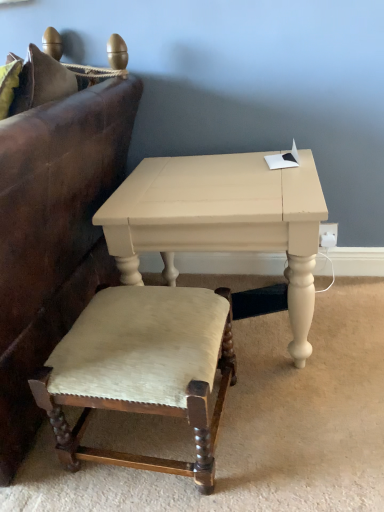
You are a GUI agent. You are given a task and a screenshot of the screen. Output one action in this format:
    pyautogui.click(x=<x>, y=<y>)
    Task: Click on the free point below velvet upholstered stool at lower left (from a real-world perspective)
    The height and width of the screenshot is (512, 384).
    Given the screenshot: What is the action you would take?
    pyautogui.click(x=148, y=435)